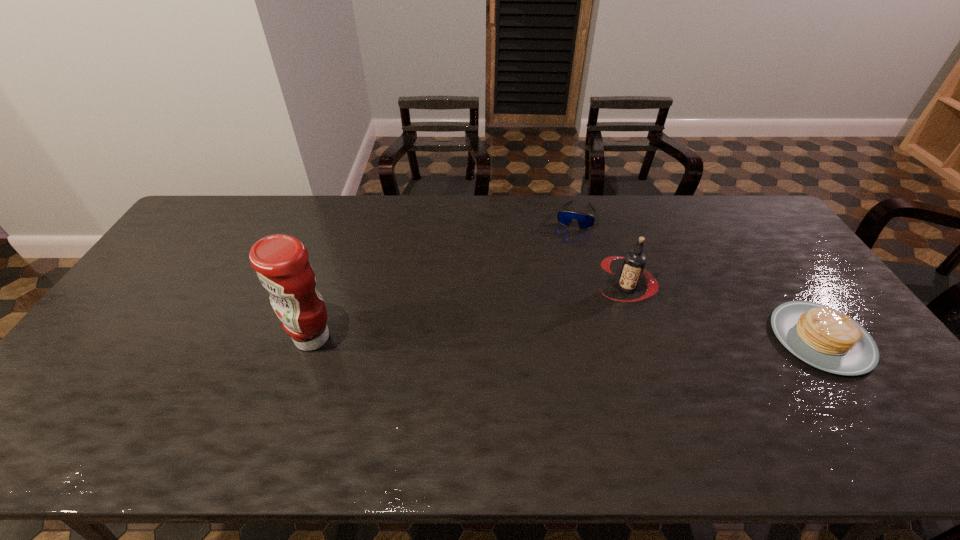
I want to click on free space on the desktop that is between the condiment and the pancake and is positioned on the label of the third shortest object, so click(587, 338).

Find the location of a particular element. The image size is (960, 540). vacant space on the desktop that is between the tallest object and the rightmost object and is positioned on the front-facing side of the farthest object is located at coordinates (541, 338).